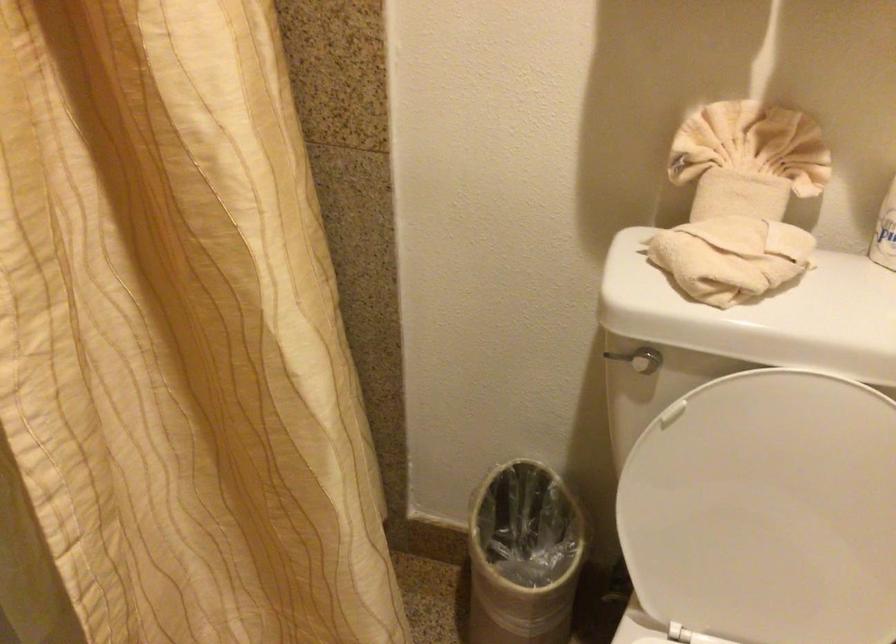
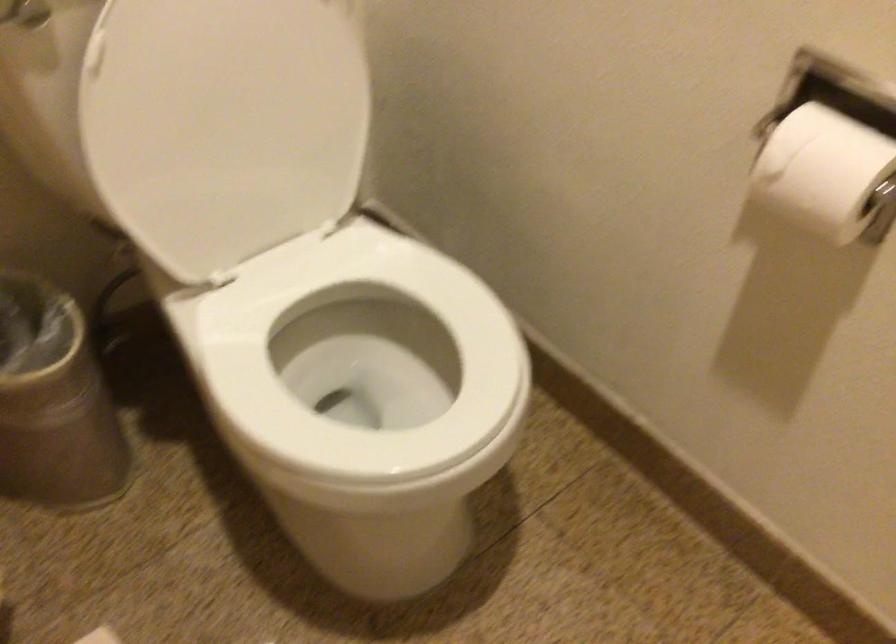
The point at (776, 515) is marked in the first image. Where is the corresponding point in the second image?

(239, 114)